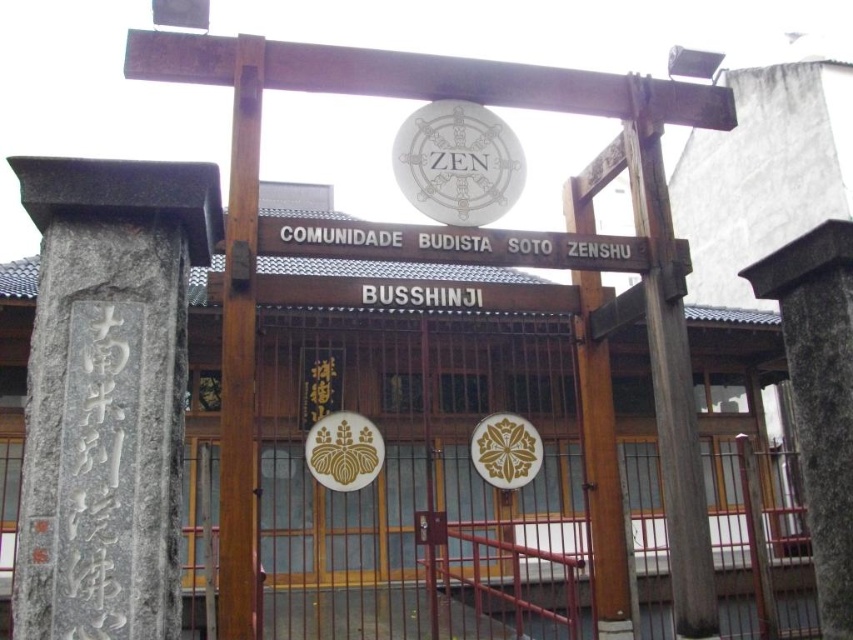
You are a visitor approaching the entrance of Comunidade Budista Soto Zenshu. You see a white wooden sign at center and a white paper sign at center. Which one is positioned to the left?

The white wooden sign at center is to the left of the white paper sign at center.

You are a visitor approaching the entrance of Comunidade Budista Soto Zenshu. You see a wooden post at center and a white wooden sign at center. Which object is located to the left when facing the entrance?

The wooden post at center is positioned on the left side of white wooden sign at center, so the wooden post at center is located to the left when facing the entrance.

You are standing at the entrance of the Buddhist community and want to find the wooden post at center. Based on the coordinates provided, where should you look relative to the torii gate?

The wooden post at center is located at coordinates point (239, 352), which means it is positioned slightly to the right and forward from the torii gate.